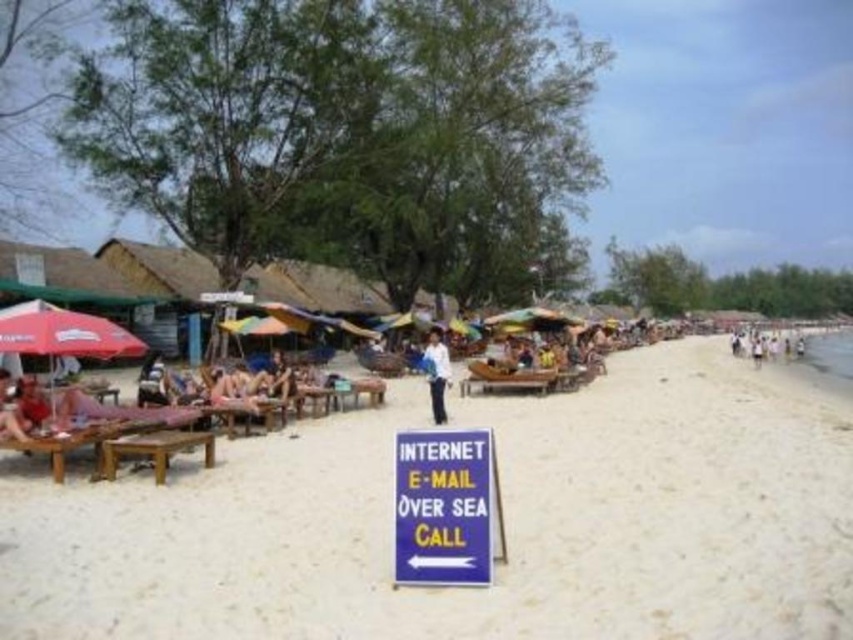
You are standing on the beach and want to reach the point marked at coordinates [50,362]. If you can walk at a speed of 1.5 meters per second, how many seconds will it take you to reach that point?

The point at coordinates [50,362] is 308.62 meters away from the viewer. At a walking speed of 1.5 meters per second, it would take approximately 205.75 seconds to reach the point.

You are a photographer at the beach scene. You see a white fabric shirt at center and a white cotton shirt at right. Which shirt is taller?

The white fabric shirt at center is taller than the white cotton shirt at right.

In the scene shown: You are standing at the camera position looking at the beach scene. There is a point marked at coordinates point (479, 465). Can you walk directly to this point from your current position without any obstacles?

The point (479, 465) is 160.66 meters away from the camera. Since the scene shows a sandy beach with a signboard, thatched huts, umbrellas, and sunbeds, there might be obstacles like the signboard, huts, or sunbeds along the path. However, the description does not mention any specific obstacles blocking the direct path. Therefore, it is possible to walk directly to the point unless there are unseen obstacles.